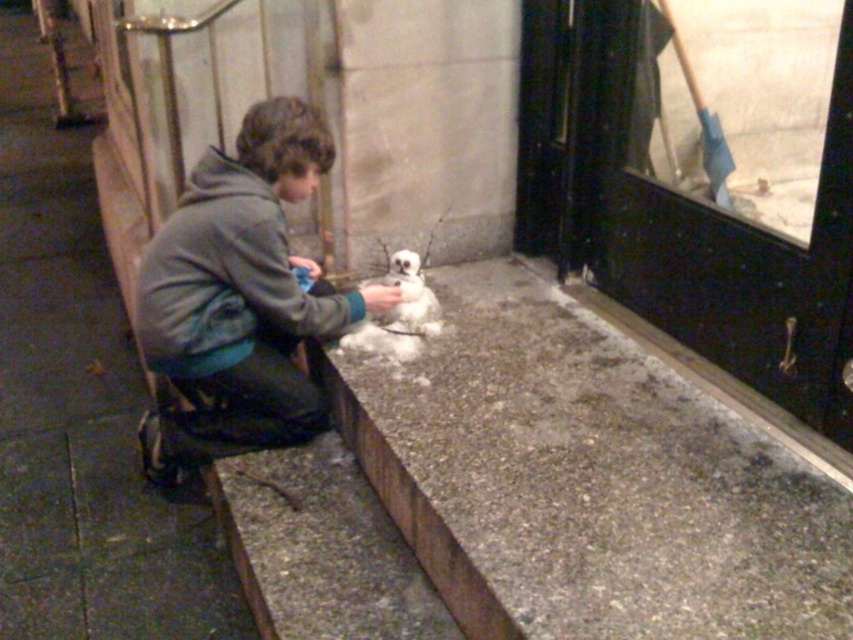
From the picture: You are standing at the point labeled point (x=793, y=566) and want to walk to the point labeled point (x=146, y=362). Which direction should you move in to get closer to your destination?

To move from point (x=793, y=566) to point (x=146, y=362), you should move downward and to the left because point (x=146, y=362) is located lower and to the left compared to point (x=793, y=566).